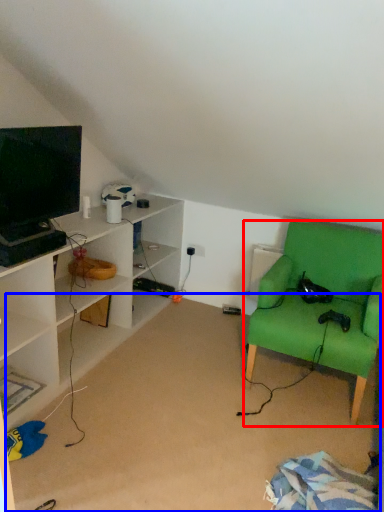
Question: Among these objects, which one is nearest to the camera, chair (highlighted by a red box) or plain (highlighted by a blue box)?

Choices:
 (A) chair
 (B) plain

Answer: (B)